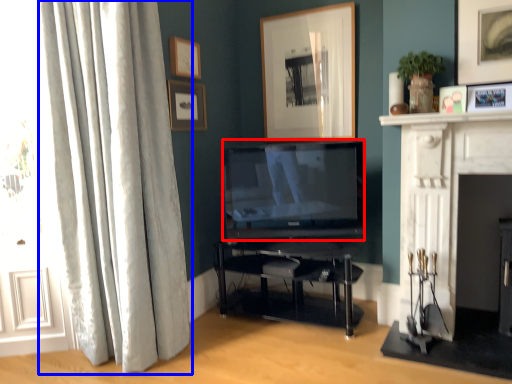
Question: Which object is closer to the camera taking this photo, television (highlighted by a red box) or curtain (highlighted by a blue box)?

Choices:
 (A) television
 (B) curtain

Answer: (B)